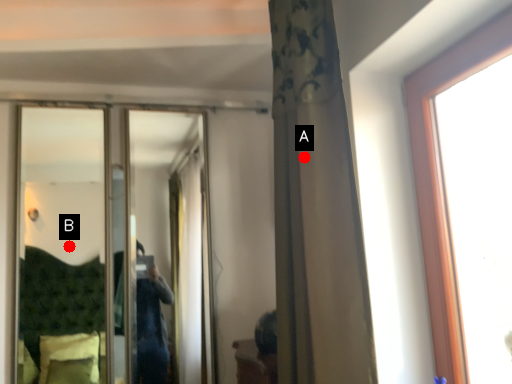
Question: Two points are circled on the image, labeled by A and B beside each circle. Which point is farther from the camera taking this photo?

Choices:
 (A) A is further
 (B) B is further

Answer: (B)